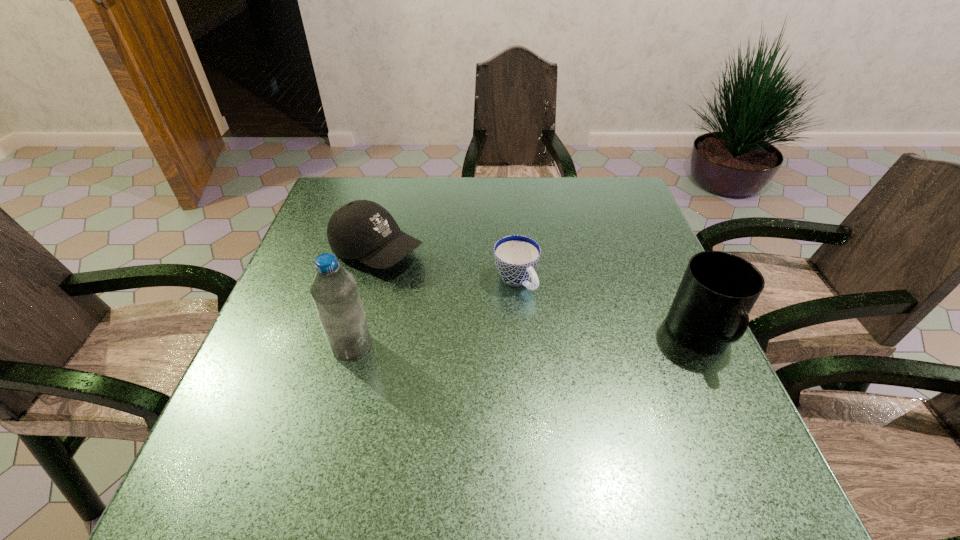
The image size is (960, 540). Find the location of `free space that is in between the third object from left to right and the rightmost object`. free space that is in between the third object from left to right and the rightmost object is located at coordinates (609, 308).

In order to click on vacant space that's between the tallest object and the second object from right to left in this screenshot , I will do `click(434, 313)`.

Where is `vacant area that lies between the mug and the cup`? The image size is (960, 540). vacant area that lies between the mug and the cup is located at coordinates (609, 308).

In order to click on object identified as the second closest to the third object from left to right in this screenshot , I will do `click(710, 310)`.

Identify which object is the third nearest to the third object from left to right. Please provide its 2D coordinates. Your answer should be formatted as a tuple, i.e. [(x, y)], where the tuple contains the x and y coordinates of a point satisfying the conditions above.

[(334, 290)]

Where is `vacant area in the image that satisfies the following two spatial constraints: 1. on the front side of the cup; 2. on the left side of the baseball cap`? Image resolution: width=960 pixels, height=540 pixels. vacant area in the image that satisfies the following two spatial constraints: 1. on the front side of the cup; 2. on the left side of the baseball cap is located at coordinates (370, 280).